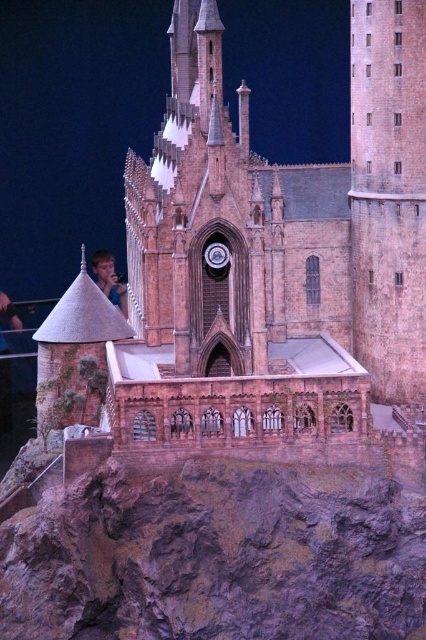
Question: Does brown brick church at center appear under light brown hair at lower left?

Choices:
 (A) yes
 (B) no

Answer: (B)

Question: Is brown brick church at center to the left of light brown hair at lower left from the viewer's perspective?

Choices:
 (A) no
 (B) yes

Answer: (A)

Question: Which of the following is the closest to the observer?

Choices:
 (A) brown brick church at center
 (B) light brown hair at lower left

Answer: (A)

Question: Which point appears farthest from the camera in this image?

Choices:
 (A) (348, 216)
 (B) (106, 264)

Answer: (B)

Question: Can you confirm if brown brick church at center is positioned to the right of light brown hair at lower left?

Choices:
 (A) no
 (B) yes

Answer: (B)